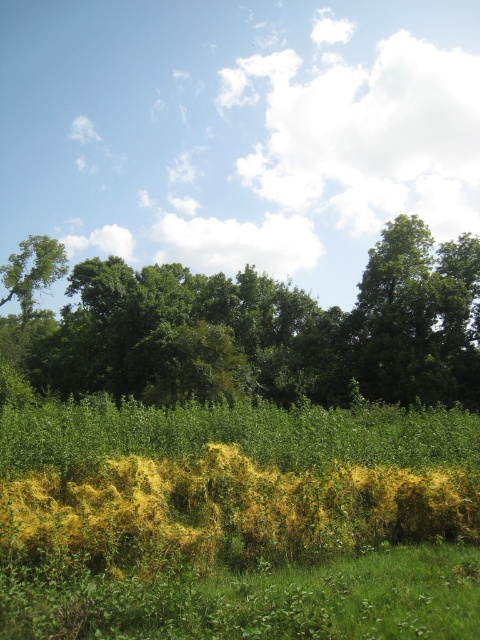
Between green leafy tree at upper right and green leafy tree at upper left, which one appears on the right side from the viewer's perspective?

green leafy tree at upper right is more to the right.

Is green leafy tree at upper right in front of green leafy tree at upper left?

That is True.

This screenshot has height=640, width=480. Describe the element at coordinates (418, 317) in the screenshot. I see `green leafy tree at upper right` at that location.

Locate an element on the screen. This screenshot has width=480, height=640. green leafy tree at upper right is located at coordinates (418, 317).

Does green leafy tree at center appear on the right side of green leafy tree at upper left?

Indeed, green leafy tree at center is positioned on the right side of green leafy tree at upper left.

Is green leafy tree at center above green leafy tree at upper left?

Actually, green leafy tree at center is below green leafy tree at upper left.

Locate an element on the screen. green leafy tree at center is located at coordinates (263, 330).

In order to click on green leafy tree at center in this screenshot , I will do `click(263, 330)`.

Which is more to the left, green leafy tree at center or green leafy tree at upper right?

From the viewer's perspective, green leafy tree at center appears more on the left side.

Can you confirm if green leafy tree at center is positioned above green leafy tree at upper right?

No, green leafy tree at center is not above green leafy tree at upper right.

Is point (139, 285) farther from camera compared to point (420, 378)?

That is True.

Where is `green leafy tree at center`? This screenshot has width=480, height=640. green leafy tree at center is located at coordinates (263, 330).